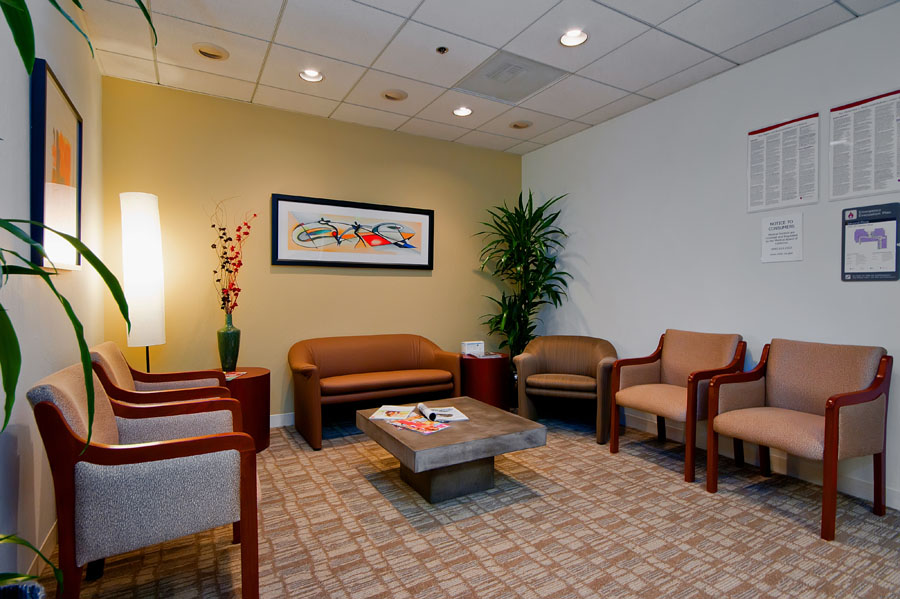
Locate an element on the screen. This screenshot has height=599, width=900. picture frame is located at coordinates (427, 228).